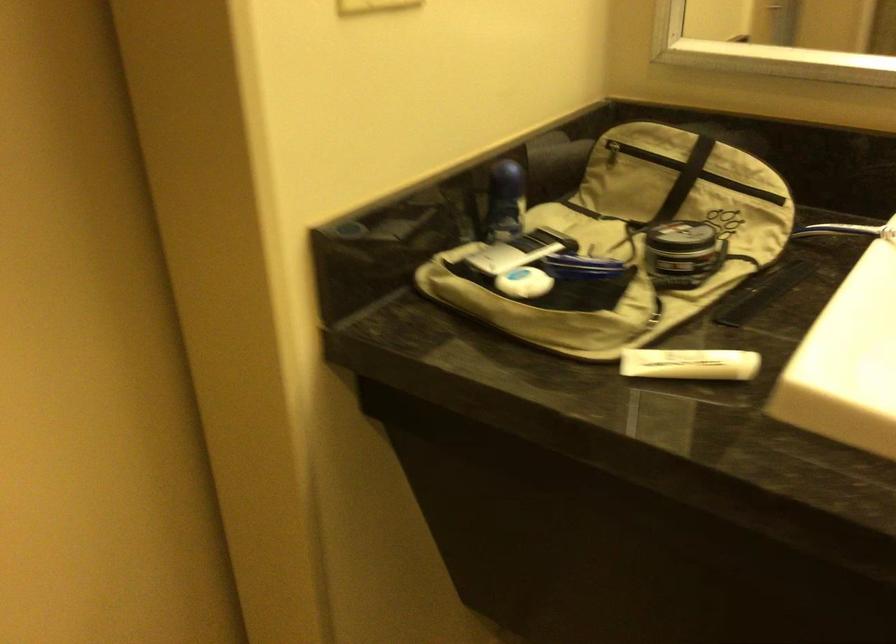
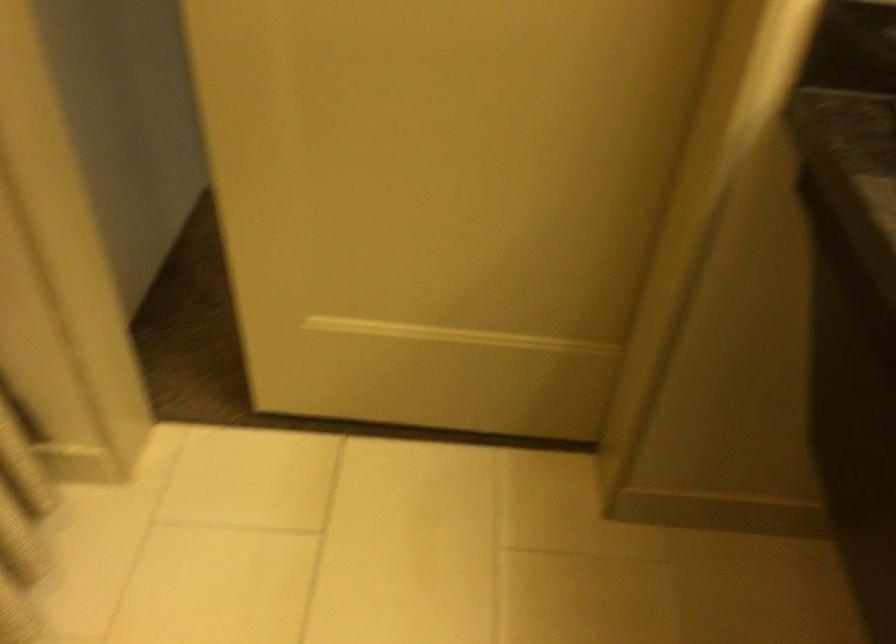
The first image is from the beginning of the video and the second image is from the end. How did the camera likely rotate when shooting the video?

The camera rotated toward left-down.